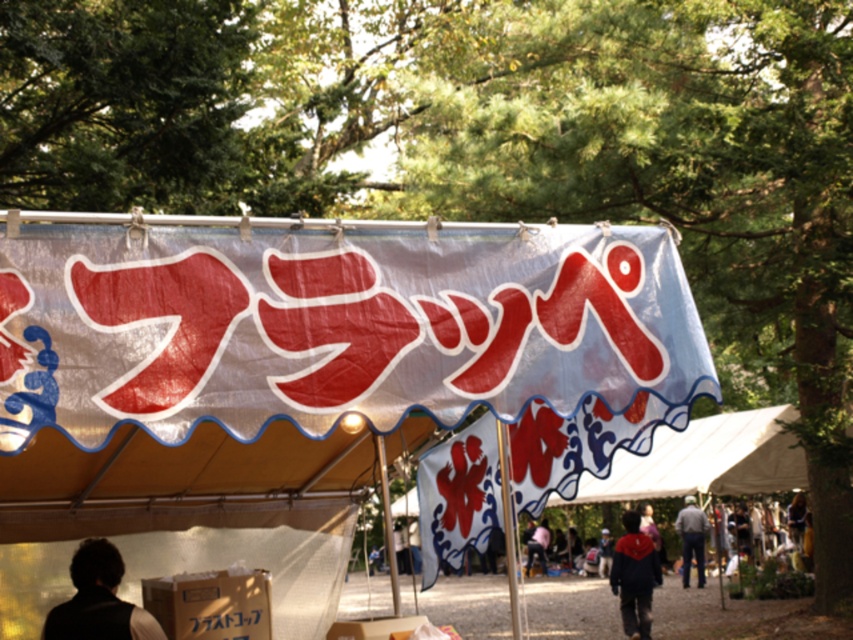
Between dark brown hair at lower left and gray fabric jacket at lower right, which one has more height?

gray fabric jacket at lower right

The image size is (853, 640). What do you see at coordinates (97, 600) in the screenshot? I see `dark brown hair at lower left` at bounding box center [97, 600].

Is point (51, 618) more distant than point (691, 508)?

That is False.

The height and width of the screenshot is (640, 853). Find the location of `dark brown hair at lower left`. dark brown hair at lower left is located at coordinates (97, 600).

Who is positioned more to the right, white fabric tent at center or red velvet cape at center?

red velvet cape at center

Between white fabric tent at center and red velvet cape at center, which one appears on the left side from the viewer's perspective?

From the viewer's perspective, white fabric tent at center appears more on the left side.

Locate an element on the screen. This screenshot has width=853, height=640. white fabric tent at center is located at coordinates tap(310, 342).

Who is shorter, dark brown hair at lower left or red velvet cape at center?

With less height is dark brown hair at lower left.

From the picture: Does dark brown hair at lower left appear under red velvet cape at center?

No.

Locate an element on the screen. This screenshot has width=853, height=640. dark brown hair at lower left is located at coordinates (97, 600).